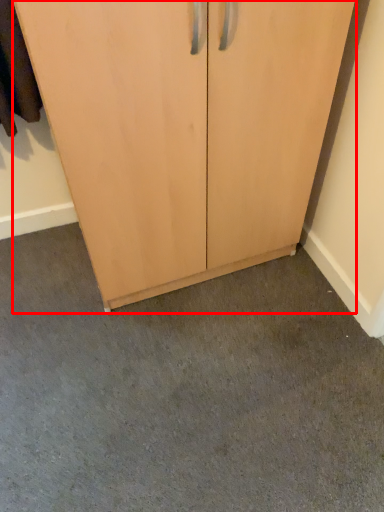
Question: From the image's perspective, what is the correct spatial positioning of cupboard (annotated by the red box) in reference to concrete?

Choices:
 (A) below
 (B) above

Answer: (B)